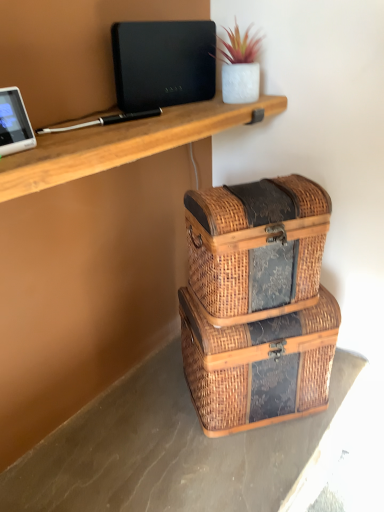
At what (x,y) coordinates should I click in order to perform the action: click on vacant space situated above woven wood trunk at center, the first storage box in the top-to-bottom sequence (from a real-world perspective). Please return your answer as a coordinate pair (x, y). Image resolution: width=384 pixels, height=512 pixels. Looking at the image, I should click on (258, 188).